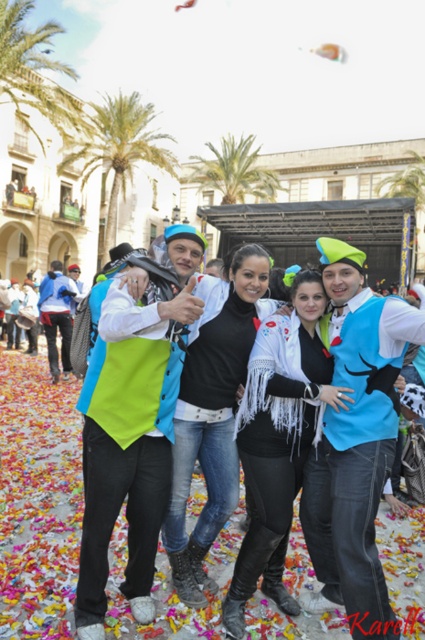
Based on the photo, you are a photographer trying to capture a photo of the white fringed jacket at center and the green leafy palm tree at center in the background. Which object should you focus on first if you want to ensure both are in focus?

The white fringed jacket at center is shorter than the green leafy palm tree at center, so you should focus on the green leafy palm tree at center first to ensure both are in focus.

You are standing in the public square and notice the blue felt vest at center. Can you determine its exact coordinates based on the image?

The blue felt vest at center is located at point (360, 456).